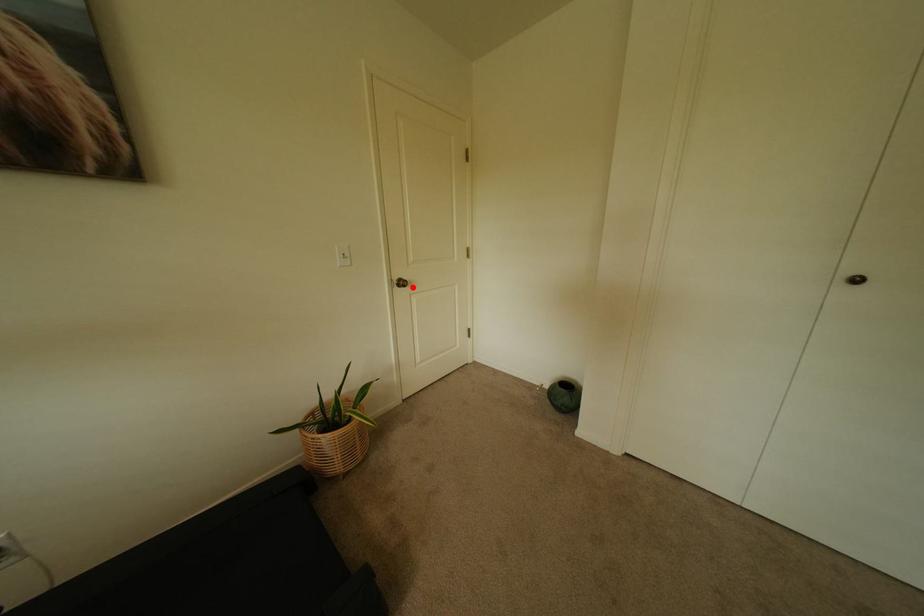
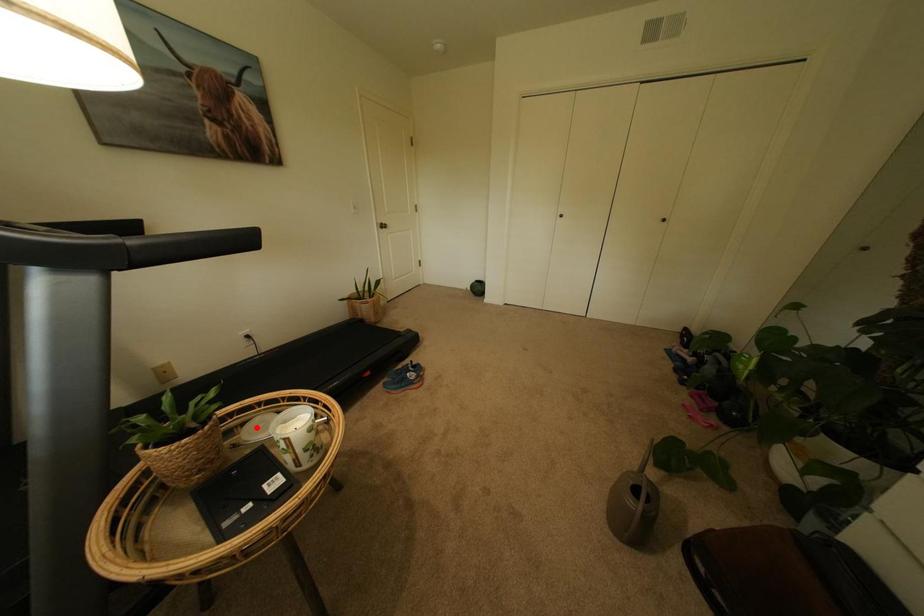
I am providing you with two images of the same scene from different viewpoints. A red point is marked on the first image and another point is marked on the second image. Does the point marked in image1 correspond to the same location as the one in image2?

No